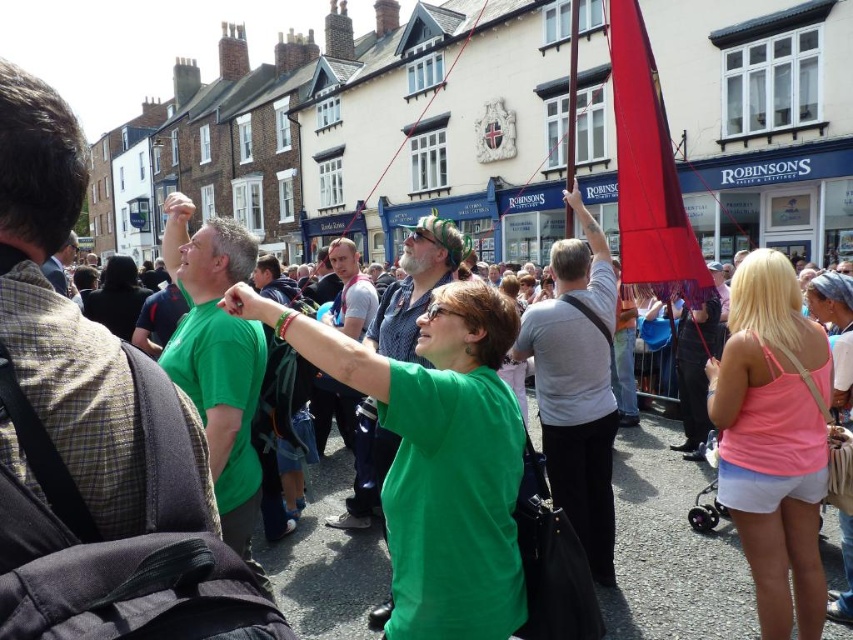
You are a photographer trying to capture the lively street scene. You notice the pink fabric tank top at center and the silky red flag at upper right. Which object should you focus on if you want to photograph the taller one?

The silky red flag at upper right is taller than the pink fabric tank top at center, so you should focus on the silky red flag at upper right.

You are a photographer standing at the center of the street. You want to take a photo that includes both the pink fabric tank top at center and the silky red flag at upper right. Given that your camera has a maximum zoom range of 50 feet, can you capture both objects in the same frame without moving?

The distance between the pink fabric tank top at center and the silky red flag at upper right is 48.23 feet, which is within the camera maximum zoom range of 50 feet. Therefore, you can capture both objects in the same frame without moving.

You are a photographer trying to capture the entire scene of the lively street event. You notice the pink fabric tank top at center and the silky red flag at upper right. Which object should you ensure is fully in frame to avoid cropping, and why?

You should ensure the silky red flag at upper right is fully in frame because it occupies more space than the pink fabric tank top at center, making it larger and more likely to be cut off if not properly framed.